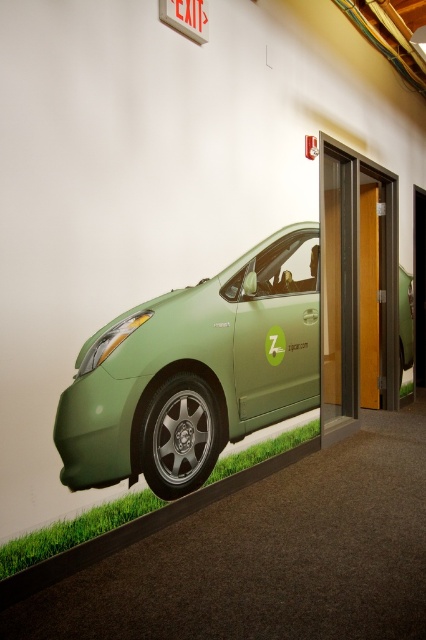
You are standing in a hallway and see the green matte car at lower left and the wooden elevator door at center. Which object is positioned to the left of the other?

The green matte car at lower left is positioned to the left of the wooden elevator door at center.

You are an interior designer assessing the hallway. You need to determine if the green matte car at lower left can fit through the wooden elevator door at center. Can it pass through vertically?

The green matte car at lower left is not as tall as the wooden elevator door at center, so it can pass through vertically.

You are a maintenance worker needing to access the elevator behind the wooden elevator door at center. There is a green matte car at lower left blocking your path. Can you walk around the car to reach the elevator?

The green matte car at lower left is in front of the wooden elevator door at center, so you can walk around the car to access the elevator.